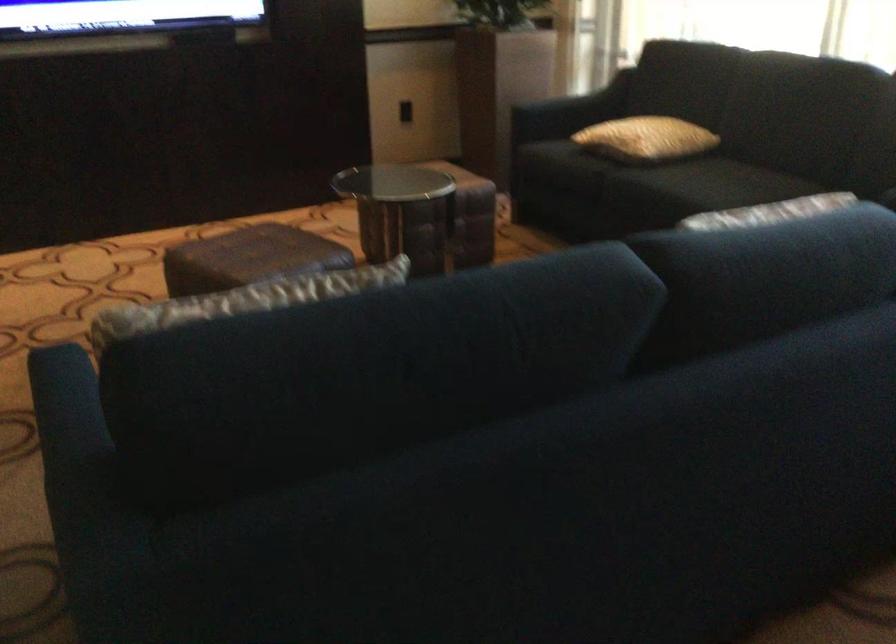
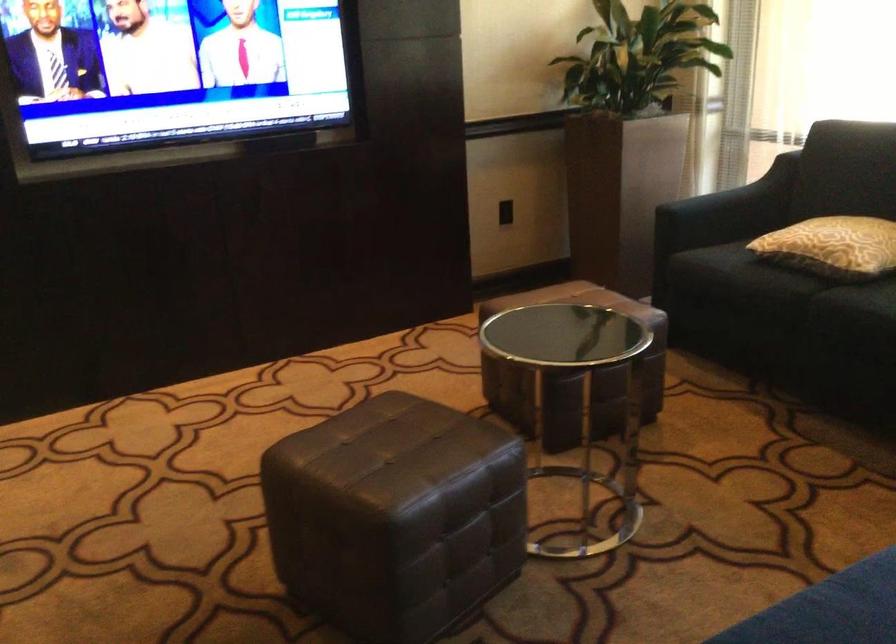
Where in the second image is the point corresponding to (625,138) from the first image?

(832, 245)